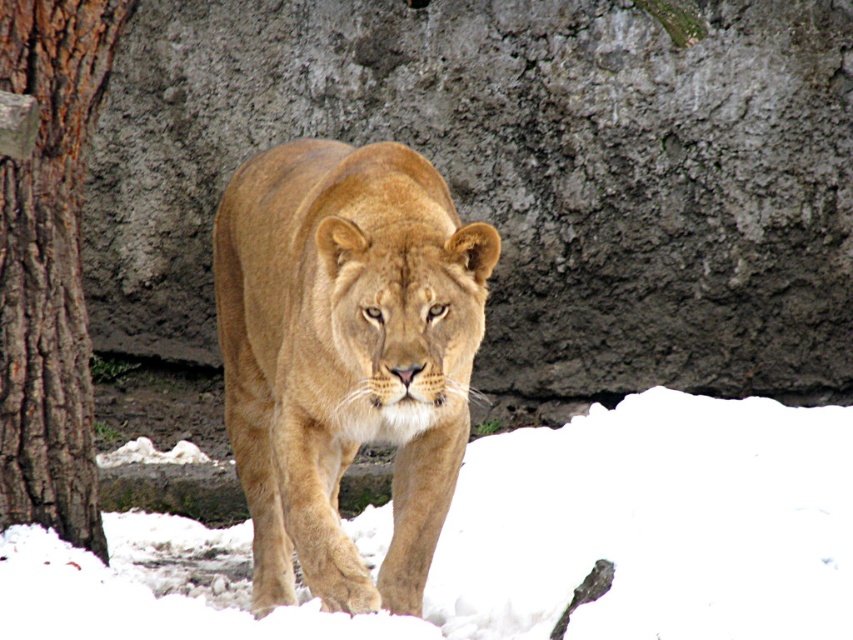
Does point (125, 536) come behind point (35, 193)?

Yes, it is.

How much distance is there between white fluffy snow at center and brown rough bark at left?

A distance of 1.68 meters exists between white fluffy snow at center and brown rough bark at left.

Between point (537, 477) and point (4, 244), which one is positioned behind?

Point (537, 477)

At what (x,y) coordinates should I click in order to perform the action: click on white fluffy snow at center. Please return your answer as a coordinate pair (x, y). The height and width of the screenshot is (640, 853). Looking at the image, I should click on (525, 540).

Who is shorter, golden fur lion at center or brown rough bark at left?

golden fur lion at center is shorter.

Between golden fur lion at center and brown rough bark at left, which one appears on the right side from the viewer's perspective?

From the viewer's perspective, golden fur lion at center appears more on the right side.

Identify the location of golden fur lion at center. This screenshot has height=640, width=853. (345, 355).

Where is `golden fur lion at center`? golden fur lion at center is located at coordinates (345, 355).

Can you confirm if white fluffy snow at center is shorter than golden fur lion at center?

Indeed, white fluffy snow at center has a lesser height compared to golden fur lion at center.

Does point (85, 554) come behind point (316, 278)?

Yes, point (85, 554) is behind point (316, 278).

You are a GUI agent. You are given a task and a screenshot of the screen. Output one action in this format:
    pyautogui.click(x=<x>, y=<y>)
    Task: Click on the white fluffy snow at center
    The width and height of the screenshot is (853, 640).
    Given the screenshot: What is the action you would take?
    click(525, 540)